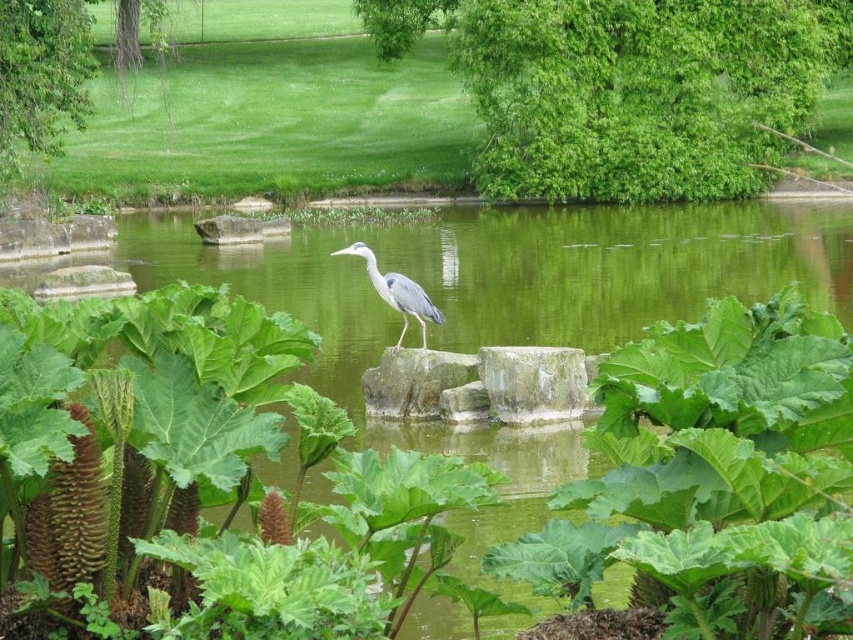
You are an ornithologist observing the scene. You need to determine the relative positions of the green leafy tree at upper center and the gray matte bird at center. Based on the scene, which object is positioned higher in the image?

The green leafy tree at upper center is located above the gray matte bird at center, so it is positioned higher in the image.

You are standing at the edge of the pond and want to take a photo of the grey heron on the rock. The camera you have can focus on objects up to 50 meters away. Is the point where the heron is standing, point (x=587, y=189), within the camera focus range?

The distance of point (x=587, y=189) from the viewer is 41.08 meters, which is within the camera focus range of up to 50 meters. Therefore, the camera can focus on the heron at that point.

You are an ornithologist observing the scene from a distance. You notice the green leafy tree at upper center and the gray matte bird at center. Which object appears larger in the image?

The green leafy tree at upper center appears larger than the gray matte bird at center in the image.